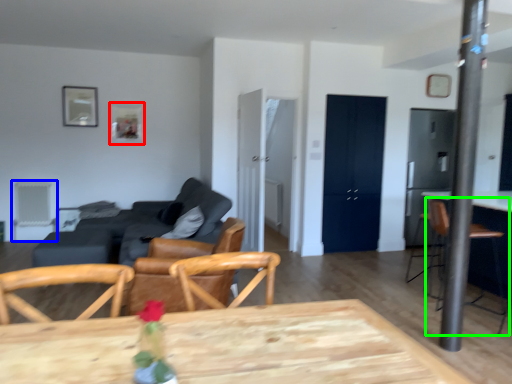
Question: Which is nearer to the picture frame (highlighted by a red box)? armchair (highlighted by a blue box) or armchair (highlighted by a green box).

Choices:
 (A) armchair
 (B) armchair

Answer: (A)